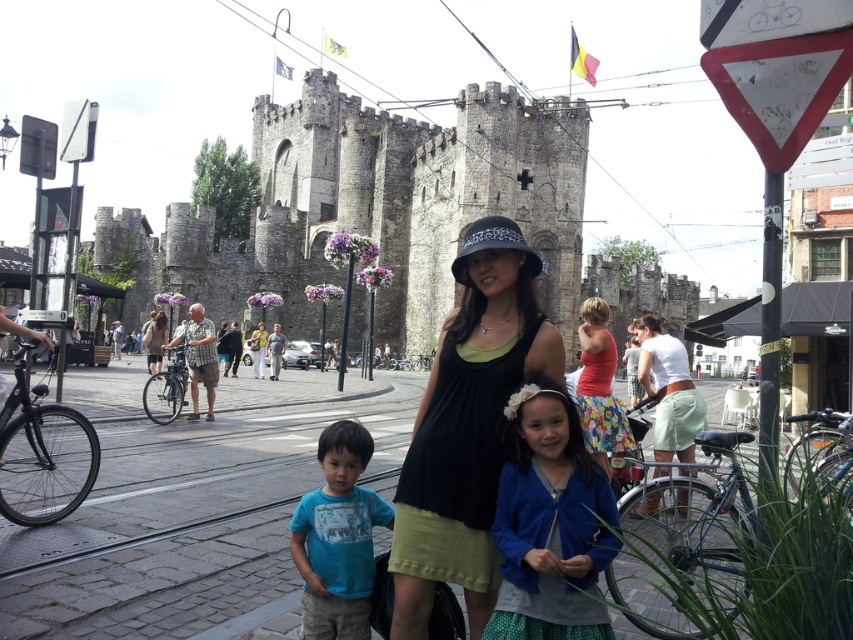
Is black matte dress at center taller than blue cotton shirt at lower left?

Yes, black matte dress at center is taller than blue cotton shirt at lower left.

Who is taller, black matte dress at center or blue cotton shirt at lower left?

black matte dress at center

Is point (437, 429) positioned in front of point (349, 481)?

That is True.

At what (x,y) coordinates should I click in order to perform the action: click on black matte dress at center. Please return your answer as a coordinate pair (x, y). This screenshot has height=640, width=853. Looking at the image, I should click on (467, 428).

Is black matte dress at center to the left of floral skirt at center from the viewer's perspective?

Indeed, black matte dress at center is positioned on the left side of floral skirt at center.

Locate an element on the screen. The height and width of the screenshot is (640, 853). black matte dress at center is located at coordinates (467, 428).

How far apart are blue cotton cardigan at center and floral skirt at center?

blue cotton cardigan at center is 28.30 feet from floral skirt at center.

Does point (509, 468) lie in front of point (595, 458)?

Yes.

Locate an element on the screen. This screenshot has height=640, width=853. blue cotton cardigan at center is located at coordinates click(x=549, y=522).